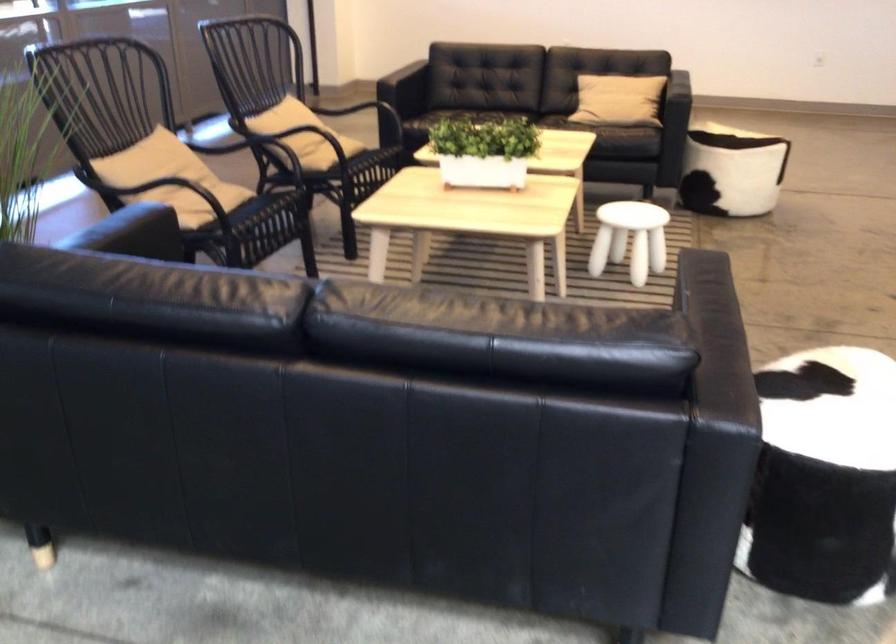
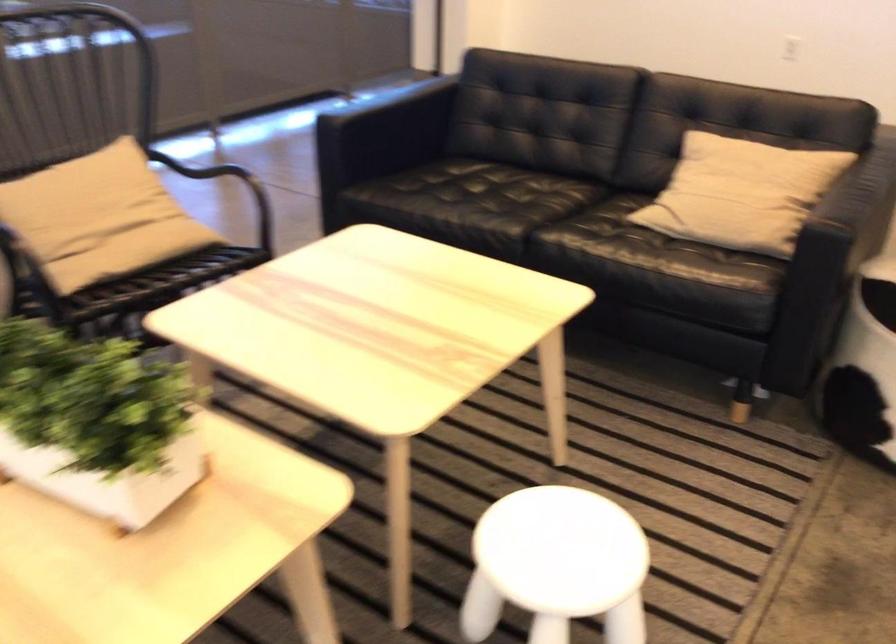
The point at (648, 86) is marked in the first image. Where is the corresponding point in the second image?

(741, 193)